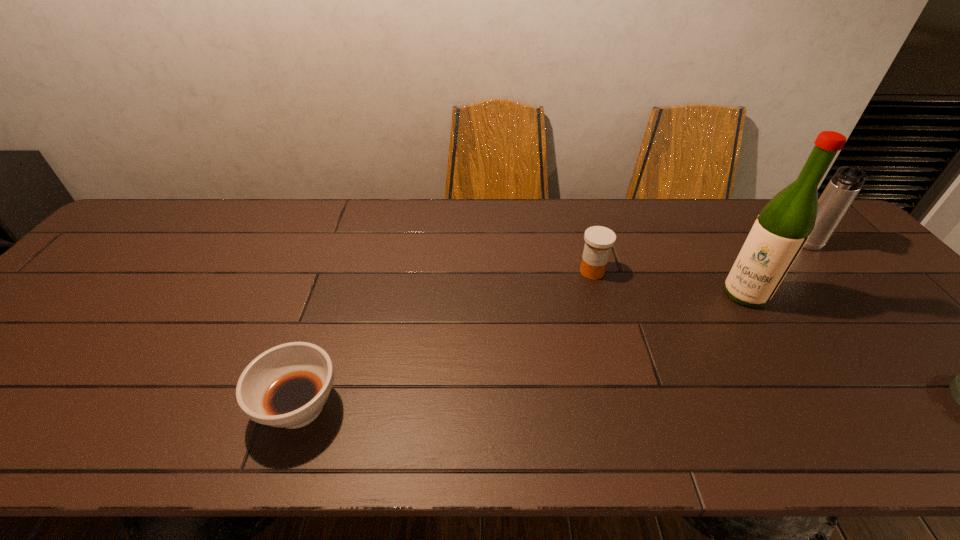
This screenshot has width=960, height=540. Identify the location of vacant area in the image that satisfies the following two spatial constraints: 1. on the back side of the liquor; 2. on the left side of the farthest object. (715, 246).